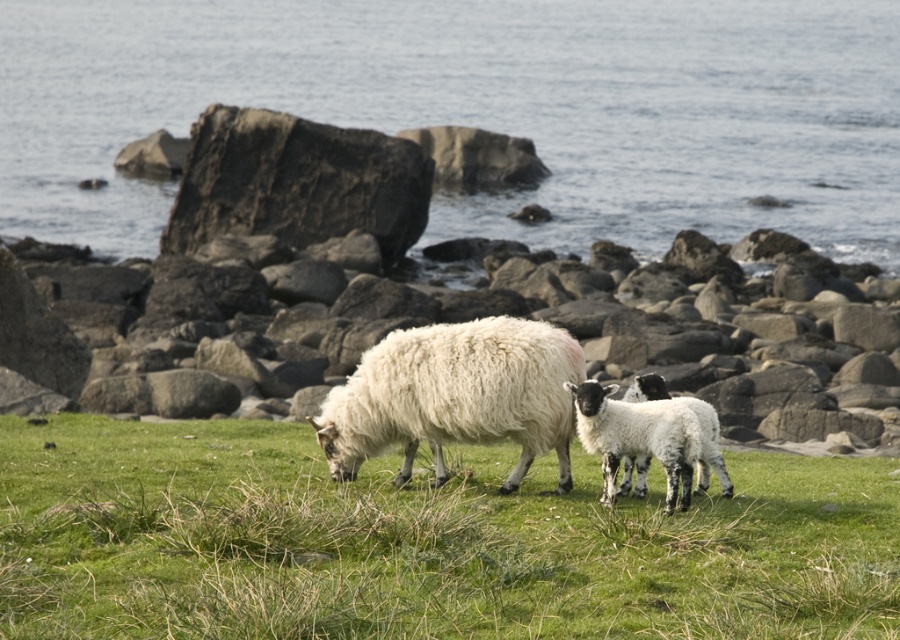
Question: Is green soft grass at center smaller than white woolen sheep at center?

Choices:
 (A) no
 (B) yes

Answer: (B)

Question: Estimate the real-world distances between objects in this image. Which object is farther from the smooth gray rock at center?

Choices:
 (A) blue water at center
 (B) white woolen sheep at center

Answer: (A)

Question: Which point appears closest to the camera in this image?

Choices:
 (A) (860, 128)
 (B) (793, 632)

Answer: (B)

Question: Does blue water at center lie behind green soft grass at center?

Choices:
 (A) no
 (B) yes

Answer: (B)

Question: Which object appears closest to the camera in this image?

Choices:
 (A) blue water at center
 (B) white woolly sheep at center
 (C) smooth gray rock at center

Answer: (B)

Question: Is the position of blue water at center more distant than that of white woolen sheep at center?

Choices:
 (A) yes
 (B) no

Answer: (A)